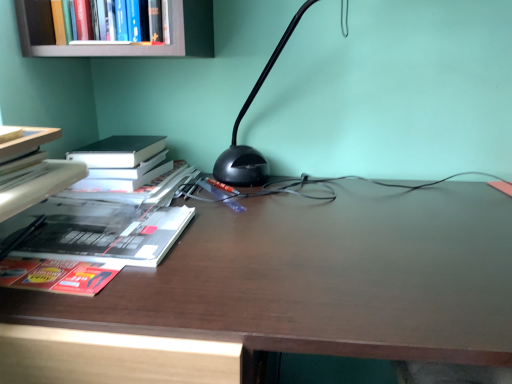
At what (x,y) coordinates should I click in order to perform the action: click on free spot above hardcover book at left, placed as the first book when sorted from bottom to top (from a real-world perspective). Please return your answer as a coordinate pair (x, y). Looking at the image, I should click on (78, 225).